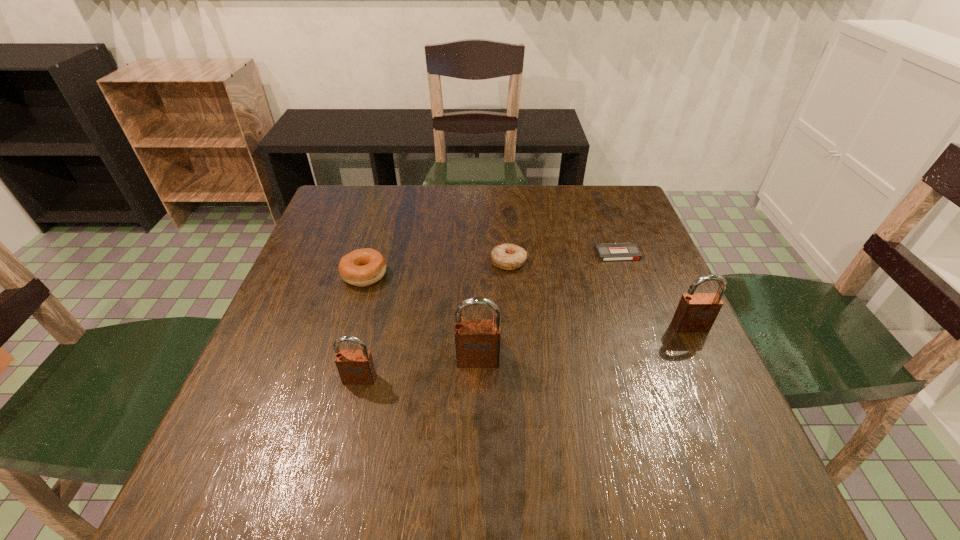
Image resolution: width=960 pixels, height=540 pixels. What are the coordinates of `the nearest padlock` in the screenshot? It's located at (355, 367).

Find the location of `the leftmost padlock`. the leftmost padlock is located at coordinates (355, 367).

Where is `the second padlock from left to right`? the second padlock from left to right is located at coordinates tap(477, 341).

The image size is (960, 540). Identify the location of the second nearest object. (477, 341).

This screenshot has width=960, height=540. Identify the location of the rightmost object. (696, 312).

At what (x,y) coordinates should I click in order to perform the action: click on the second tallest padlock. Please return your answer as a coordinate pair (x, y). Image resolution: width=960 pixels, height=540 pixels. Looking at the image, I should click on (696, 312).

Identify the location of bagel. The width and height of the screenshot is (960, 540). (364, 267).

At what (x,y) coordinates should I click in order to perform the action: click on doughnut. Please return your answer as a coordinate pair (x, y). Looking at the image, I should click on (506, 256).

At what (x,y) coordinates should I click in order to perform the action: click on the second object from right to left. Please return your answer as a coordinate pair (x, y). Looking at the image, I should click on (621, 251).

The width and height of the screenshot is (960, 540). Identify the location of videotape. (621, 251).